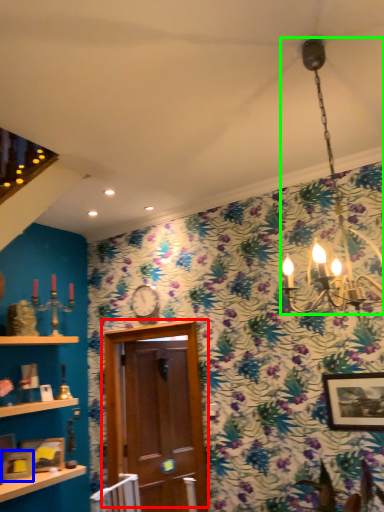
Question: Estimate the real-world distances between objects in this image. Which object is closer to door (highlighted by a red box), picture frame (highlighted by a blue box) or lamp (highlighted by a green box)?

Choices:
 (A) picture frame
 (B) lamp

Answer: (A)